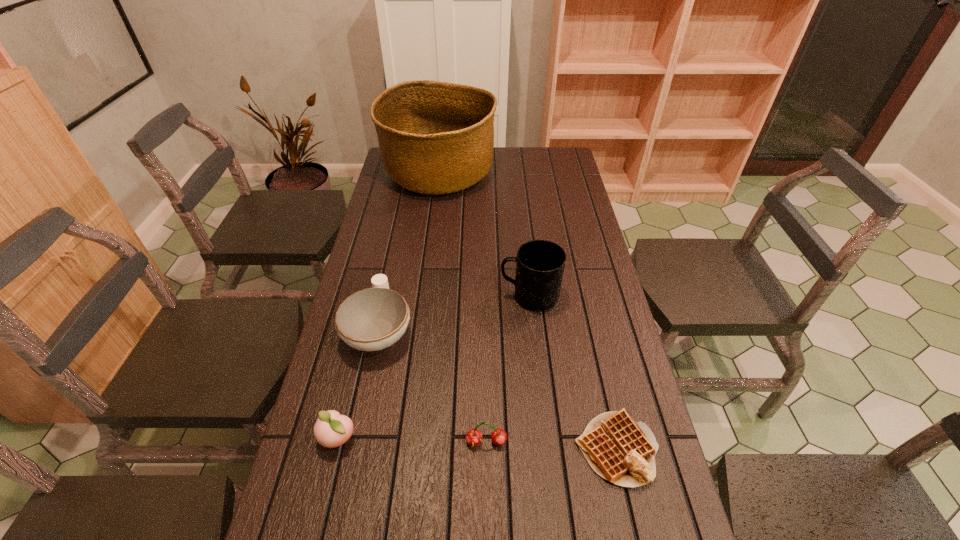
This screenshot has width=960, height=540. I want to click on vacant space located 0.070m on the side of the fifth shortest object with the handle, so click(476, 296).

The width and height of the screenshot is (960, 540). In order to click on free location located 0.130m on the side with the handle of the chinaware in this screenshot , I will do `click(393, 269)`.

The width and height of the screenshot is (960, 540). I want to click on vacant space situated on the side with the handle of the chinaware, so click(x=400, y=232).

This screenshot has height=540, width=960. I want to click on free spot located 0.130m on the side with the handle of the chinaware, so [393, 269].

Where is `vacant space located 0.080m on the back of the peach`? Image resolution: width=960 pixels, height=540 pixels. vacant space located 0.080m on the back of the peach is located at coordinates pos(349,392).

Find the location of `free space located with stems pointing upwards on the cherry`. free space located with stems pointing upwards on the cherry is located at coordinates (487, 493).

Locate an element on the screen. This screenshot has width=960, height=540. vacant space located on the left of the shortest object is located at coordinates (481, 449).

You are a GUI agent. You are given a task and a screenshot of the screen. Output one action in this format:
    pyautogui.click(x=<x>, y=<y>)
    Task: Click on the object at the far edge
    This screenshot has height=540, width=960.
    Given the screenshot: What is the action you would take?
    pyautogui.click(x=435, y=138)

What are the coordinates of `basket situated at the left edge` in the screenshot? It's located at (435, 138).

At what (x,y) coordinates should I click in order to perform the action: click on chinaware situated at the left edge. Please return your answer as a coordinate pair (x, y). Image resolution: width=960 pixels, height=540 pixels. Looking at the image, I should click on (372, 319).